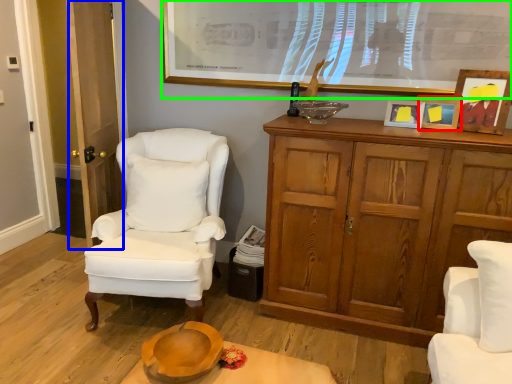
Question: Which is farther away from picture frame (highlighted by a red box)? glass door (highlighted by a blue box) or picture frame (highlighted by a green box)?

Choices:
 (A) glass door
 (B) picture frame

Answer: (A)